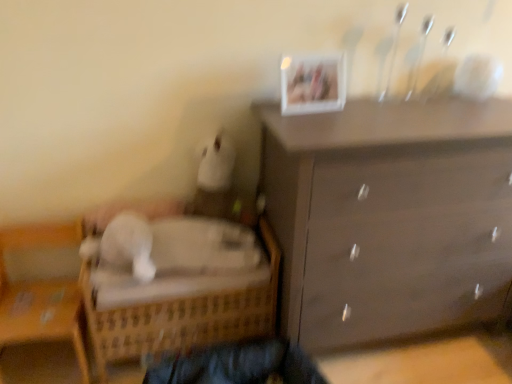
Question: Does white plastic picture frame at upper center lie behind wooden wicker basket at lower left?

Choices:
 (A) no
 (B) yes

Answer: (B)

Question: Is there a large distance between white plastic picture frame at upper center and wooden wicker basket at lower left?

Choices:
 (A) no
 (B) yes

Answer: (B)

Question: Is white plastic picture frame at upper center not inside wooden wicker basket at lower left?

Choices:
 (A) no
 (B) yes

Answer: (B)

Question: Can you confirm if white plastic picture frame at upper center is smaller than wooden wicker basket at lower left?

Choices:
 (A) yes
 (B) no

Answer: (A)

Question: From the image's perspective, does white plastic picture frame at upper center appear higher than wooden wicker basket at lower left?

Choices:
 (A) yes
 (B) no

Answer: (A)

Question: Considering the relative positions of white plastic picture frame at upper center and wooden wicker basket at lower left in the image provided, is white plastic picture frame at upper center to the right of wooden wicker basket at lower left from the viewer's perspective?

Choices:
 (A) no
 (B) yes

Answer: (B)

Question: Is matte brown dresser at upper right closer to the viewer compared to white plastic picture frame at upper center?

Choices:
 (A) no
 (B) yes

Answer: (B)

Question: Is matte brown dresser at upper right to the right of white plastic picture frame at upper center from the viewer's perspective?

Choices:
 (A) yes
 (B) no

Answer: (A)

Question: Is matte brown dresser at upper right placed right next to white plastic picture frame at upper center?

Choices:
 (A) yes
 (B) no

Answer: (B)

Question: From a real-world perspective, is matte brown dresser at upper right positioned under white plastic picture frame at upper center based on gravity?

Choices:
 (A) yes
 (B) no

Answer: (A)

Question: Is matte brown dresser at upper right positioned with its back to white plastic picture frame at upper center?

Choices:
 (A) yes
 (B) no

Answer: (B)

Question: Is matte brown dresser at upper right oriented towards white plastic picture frame at upper center?

Choices:
 (A) yes
 (B) no

Answer: (B)

Question: Is woven wood bed at lower left outside wooden wicker basket at lower left?

Choices:
 (A) no
 (B) yes

Answer: (B)